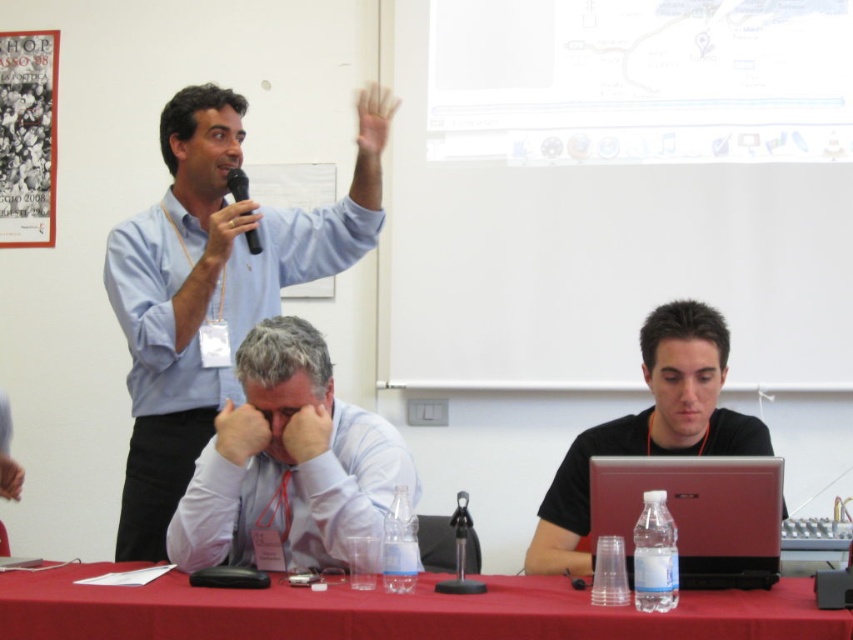
Is light blue shirt at upper left wider than black matte microphone at upper left?

Indeed, light blue shirt at upper left has a greater width compared to black matte microphone at upper left.

Where is `light blue shirt at upper left`? light blue shirt at upper left is located at coordinates (212, 289).

You are a GUI agent. You are given a task and a screenshot of the screen. Output one action in this format:
    pyautogui.click(x=<x>, y=<y>)
    Task: Click on the light blue shirt at upper left
    
    Given the screenshot: What is the action you would take?
    pyautogui.click(x=212, y=289)

Does red cloth table at lower center have a lesser width compared to white shirt at center?

Incorrect, red cloth table at lower center's width is not less than white shirt at center's.

Measure the distance between red cloth table at lower center and camera.

red cloth table at lower center and camera are 1.37 meters apart from each other.

Is point (598, 618) closer to camera compared to point (263, 358)?

Yes, it is in front of point (263, 358).

Locate an element on the screen. The width and height of the screenshot is (853, 640). red cloth table at lower center is located at coordinates tap(392, 611).

Can you confirm if light blue shirt at upper left is positioned to the left of white shirt at center?

Indeed, light blue shirt at upper left is positioned on the left side of white shirt at center.

Is light blue shirt at upper left closer to the viewer compared to white shirt at center?

No, it is not.

Between point (251, 300) and point (267, 433), which one is positioned behind?

Point (251, 300)

I want to click on light blue shirt at upper left, so click(x=212, y=289).